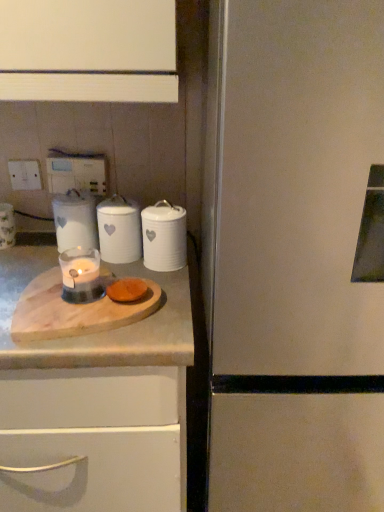
Find the location of a particular element. vacant point to the right of translucent glass candle at center is located at coordinates (166, 306).